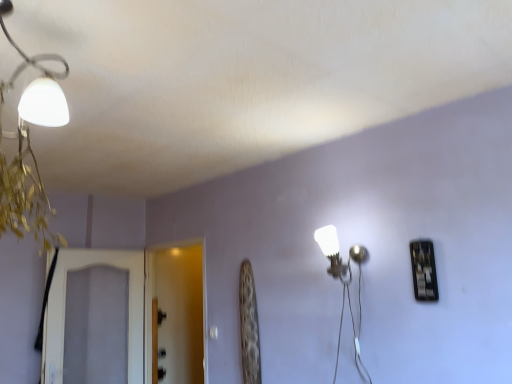
Question: Relative to transparent glass screen door at center, the 2th screen door from the left, is white glossy wall lamp at center-right in front or behind?

Choices:
 (A) front
 (B) behind

Answer: (A)

Question: From their relative heights in the image, would you say white glossy wall lamp at center-right is taller or shorter than transparent glass screen door at center, the 2th screen door from the left?

Choices:
 (A) short
 (B) tall

Answer: (A)

Question: Which of these objects is positioned closest to the white glossy wall lamp at center-right?

Choices:
 (A) transparent glass screen door at center, the 2th screen door from the left
 (B) white textured screen door at left, the 1th screen door viewed from the left

Answer: (B)

Question: Which of these objects is positioned closest to the white textured screen door at left, the 1th screen door viewed from the left?

Choices:
 (A) transparent glass screen door at center, the 2th screen door from the left
 (B) white glossy wall lamp at center-right

Answer: (A)